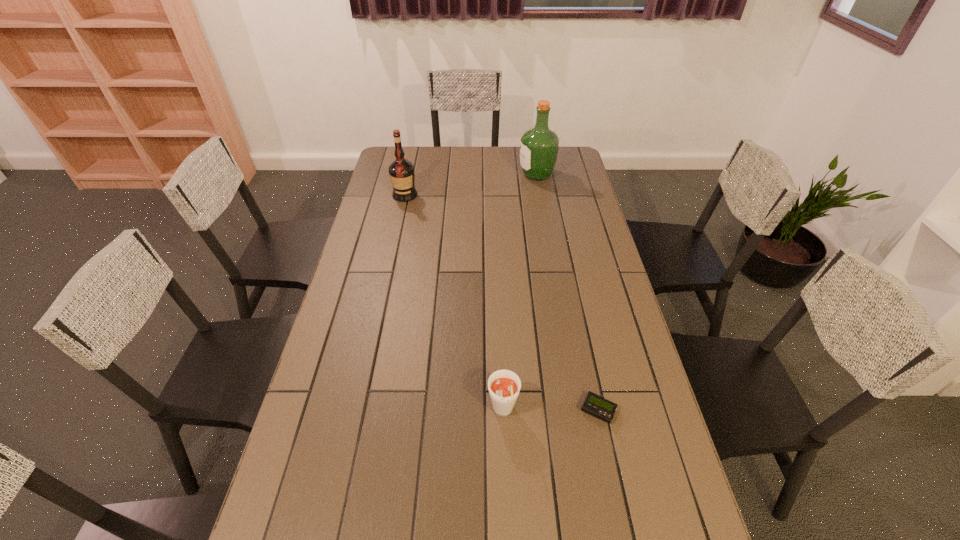
Where is `the farthest object`? the farthest object is located at coordinates (539, 146).

I want to click on the farther liquor, so click(x=539, y=146).

Where is `the left liquor`? This screenshot has height=540, width=960. the left liquor is located at coordinates click(x=401, y=171).

You are a GUI agent. You are given a task and a screenshot of the screen. Output one action in this format:
    pyautogui.click(x=<x>, y=<y>)
    Task: Click on the third shortest object
    The width and height of the screenshot is (960, 540).
    Given the screenshot: What is the action you would take?
    pyautogui.click(x=401, y=171)

Locate an element on the screen. This screenshot has width=960, height=540. root beer is located at coordinates (504, 386).

Locate an element on the screen. the third tallest object is located at coordinates (504, 386).

Where is `beeper`? The image size is (960, 540). beeper is located at coordinates (595, 405).

Where is `vacant region located 0.070m on the front-facing side of the farthest object`? vacant region located 0.070m on the front-facing side of the farthest object is located at coordinates (503, 175).

Where is `free location located on the front-facing side of the farthest object`? The width and height of the screenshot is (960, 540). free location located on the front-facing side of the farthest object is located at coordinates (456, 175).

In order to click on blank area located on the front-facing side of the farthest object in this screenshot , I will do `click(507, 175)`.